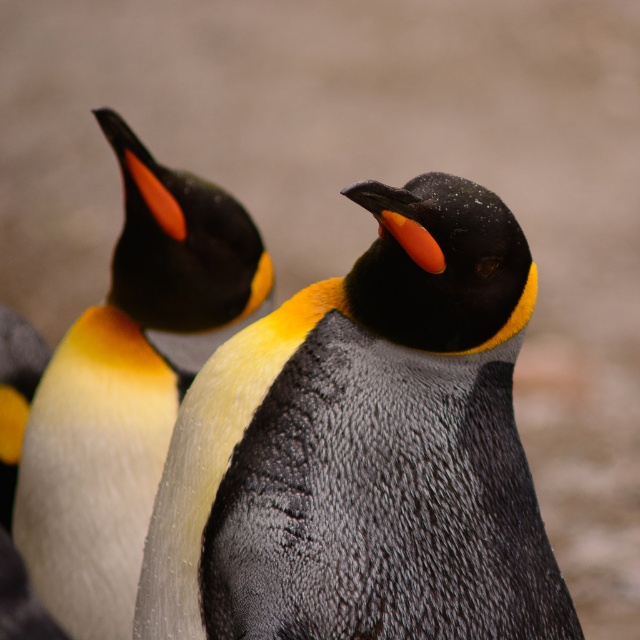
Based on the photo, can you confirm if textured gray penguin at center is thinner than white fluffy penguin at left?

In fact, textured gray penguin at center might be wider than white fluffy penguin at left.

Where is `textured gray penguin at center`? textured gray penguin at center is located at coordinates (365, 449).

Between matte black penguin at upper left and white fluffy penguin at left, which one is positioned higher?

Positioned higher is matte black penguin at upper left.

Looking at this image, does matte black penguin at upper left appear over white fluffy penguin at left?

Yes.

Between point (140, 170) and point (4, 374), which one is positioned in front?

Positioned in front is point (140, 170).

I want to click on matte black penguin at upper left, so 129,385.

Measure the distance between textured gray penguin at center and matte black penguin at upper left.

textured gray penguin at center and matte black penguin at upper left are 1.02 meters apart.

Is textured gray penguin at center shorter than matte black penguin at upper left?

Yes.

Is point (220, 403) less distant than point (125, 188)?

Yes, point (220, 403) is closer to viewer.

Where is `textured gray penguin at center`? This screenshot has height=640, width=640. textured gray penguin at center is located at coordinates (365, 449).